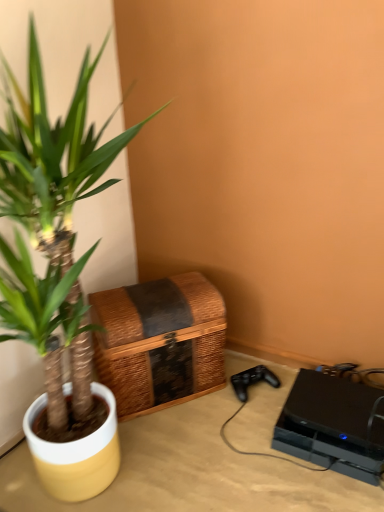
Locate an element on the screen. Image resolution: width=384 pixels, height=512 pixels. vacant area that lies between green leafy plant at left and woven brown basket at lower left is located at coordinates (205, 411).